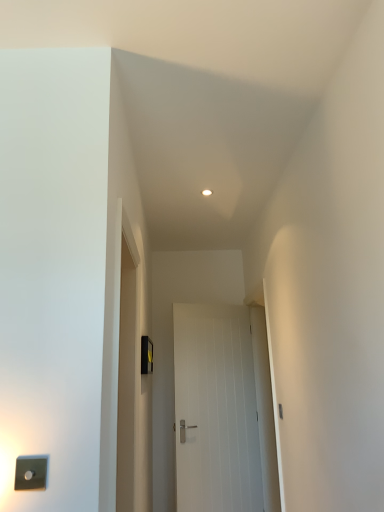
At what (x,y) coordinates should I click in order to perform the action: click on white smooth door at center. Please return your answer as a coordinate pair (x, y). The width and height of the screenshot is (384, 512). Looking at the image, I should click on (216, 410).

This screenshot has height=512, width=384. Describe the element at coordinates (30, 473) in the screenshot. I see `satin silver switch at lower left, arranged as the first light switch when viewed from the front` at that location.

In order to face black plastic light switch at center, the first light switch when ordered from right to left, should I rotate leftwards or rightwards?

Rotate your view left by about 5.717°.

The image size is (384, 512). I want to click on white smooth door at center, so click(216, 410).

Which object is wider, satin silver switch at lower left, which appears as the 1th light switch when viewed from the left, or black plastic light switch at center, the 2th light switch when ordered from front to back?

black plastic light switch at center, the 2th light switch when ordered from front to back.

From the picture: Choose the correct answer: Is satin silver switch at lower left, arranged as the 2th light switch when viewed from the right, inside black plastic light switch at center, the 2th light switch when ordered from front to back, or outside it?

satin silver switch at lower left, arranged as the 2th light switch when viewed from the right, cannot be found inside black plastic light switch at center, the 2th light switch when ordered from front to back.

Based on the photo, does satin silver switch at lower left, arranged as the first light switch when viewed from the front, appear on the left side of black plastic light switch at center, the first light switch when ordered from right to left?

Correct, you'll find satin silver switch at lower left, arranged as the first light switch when viewed from the front, to the left of black plastic light switch at center, the first light switch when ordered from right to left.

How distant is satin silver switch at lower left, arranged as the 2th light switch when viewed from the right, from black plastic light switch at center, which is counted as the 2th light switch, starting from the left?

They are 8.28 feet apart.

Is black plastic light switch at center, the 2th light switch when ordered from front to back, facing away from satin silver switch at lower left, arranged as the first light switch when viewed from the front?

That's not correct — black plastic light switch at center, the 2th light switch when ordered from front to back, is not looking away from satin silver switch at lower left, arranged as the first light switch when viewed from the front.

Which of these two, black plastic light switch at center, the 2th light switch when ordered from front to back, or satin silver switch at lower left, arranged as the 2th light switch when viewed from the right, is smaller?

With smaller size is satin silver switch at lower left, arranged as the 2th light switch when viewed from the right.

From a real-world perspective, who is located lower, black plastic light switch at center, which is counted as the 2th light switch, starting from the left, or satin silver switch at lower left, which appears as the 1th light switch when viewed from the left?

In real-world perspective, satin silver switch at lower left, which appears as the 1th light switch when viewed from the left, is lower.

Is satin silver switch at lower left, arranged as the first light switch when viewed from the front, looking in the opposite direction of white smooth door at center?

Correct, satin silver switch at lower left, arranged as the first light switch when viewed from the front, is looking away from white smooth door at center.

Locate an element on the screen. The image size is (384, 512). door below the satin silver switch at lower left, which appears as the 1th light switch when viewed from the left (from the image's perspective) is located at coordinates (216, 410).

How different are the orientations of satin silver switch at lower left, which appears as the 1th light switch when viewed from the left, and white smooth door at center in degrees?

The angle between the facing direction of satin silver switch at lower left, which appears as the 1th light switch when viewed from the left, and the facing direction of white smooth door at center is 26.5 degrees.

Between satin silver switch at lower left, positioned as the 2th light switch in back-to-front order, and white smooth door at center, which one has more height?

Standing taller between the two is white smooth door at center.

Which is correct: black plastic light switch at center, placed as the 1th light switch when sorted from back to front, is inside white smooth door at center, or outside of it?

The correct answer is: outside.

From the image's perspective, which object appears higher, black plastic light switch at center, the 2th light switch when ordered from front to back, or white smooth door at center?

black plastic light switch at center, the 2th light switch when ordered from front to back, appears higher in the image.

How different are the orientations of black plastic light switch at center, the first light switch when ordered from right to left, and white smooth door at center in degrees?

black plastic light switch at center, the first light switch when ordered from right to left, and white smooth door at center are facing 64.4 degrees away from each other.

Consider the image. From a real-world perspective, is black plastic light switch at center, the 2th light switch when ordered from front to back, on white smooth door at center?

Yes.

From the image's perspective, does white smooth door at center appear higher than satin silver switch at lower left, positioned as the 2th light switch in back-to-front order?

No, from the image's perspective, white smooth door at center is not on top of satin silver switch at lower left, positioned as the 2th light switch in back-to-front order.

Is white smooth door at center in contact with satin silver switch at lower left, positioned as the 2th light switch in back-to-front order?

No, white smooth door at center is not in contact with satin silver switch at lower left, positioned as the 2th light switch in back-to-front order.

Which object is wider, white smooth door at center or satin silver switch at lower left, positioned as the 2th light switch in back-to-front order?

white smooth door at center.

Where is `door behind the black plastic light switch at center, placed as the 1th light switch when sorted from back to front`? The image size is (384, 512). door behind the black plastic light switch at center, placed as the 1th light switch when sorted from back to front is located at coordinates (216, 410).

Between point (184, 341) and point (144, 371), which one is positioned behind?

The point (184, 341) is behind.

From a real-world perspective, which is physically below, white smooth door at center or black plastic light switch at center, the 2th light switch when ordered from front to back?

From a 3D spatial view, white smooth door at center is below.

The width and height of the screenshot is (384, 512). I want to click on light switch above the satin silver switch at lower left, arranged as the first light switch when viewed from the front (from a real-world perspective), so click(146, 355).

You are a GUI agent. You are given a task and a screenshot of the screen. Output one action in this format:
    pyautogui.click(x=<x>, y=<y>)
    Task: Click on the light switch that appears below the black plastic light switch at center, the 2th light switch when ordered from front to back (from a real-world perspective)
    Image resolution: width=384 pixels, height=512 pixels.
    Given the screenshot: What is the action you would take?
    pyautogui.click(x=30, y=473)

When comparing their distances from black plastic light switch at center, the first light switch when ordered from right to left, does satin silver switch at lower left, arranged as the first light switch when viewed from the front, or white smooth door at center seem further?

satin silver switch at lower left, arranged as the first light switch when viewed from the front, lies further to black plastic light switch at center, the first light switch when ordered from right to left, than the other object.

When comparing their distances from satin silver switch at lower left, which appears as the 1th light switch when viewed from the left, does black plastic light switch at center, the 2th light switch when ordered from front to back, or white smooth door at center seem closer?

The object closer to satin silver switch at lower left, which appears as the 1th light switch when viewed from the left, is black plastic light switch at center, the 2th light switch when ordered from front to back.

Looking at the image, which one is located further to satin silver switch at lower left, arranged as the first light switch when viewed from the front, white smooth door at center or black plastic light switch at center, placed as the 1th light switch when sorted from back to front?

white smooth door at center.

Considering their positions, is satin silver switch at lower left, which appears as the 1th light switch when viewed from the left, positioned closer to white smooth door at center than black plastic light switch at center, the first light switch when ordered from right to left?

The object closer to white smooth door at center is black plastic light switch at center, the first light switch when ordered from right to left.

Looking at the image, which one is located closer to black plastic light switch at center, the 2th light switch when ordered from front to back, white smooth door at center or satin silver switch at lower left, arranged as the first light switch when viewed from the front?

Based on the image, white smooth door at center appears to be nearer to black plastic light switch at center, the 2th light switch when ordered from front to back.

Considering their positions, is black plastic light switch at center, the first light switch when ordered from right to left, positioned further to white smooth door at center than satin silver switch at lower left, arranged as the 2th light switch when viewed from the right?

The object further to white smooth door at center is satin silver switch at lower left, arranged as the 2th light switch when viewed from the right.

Locate an element on the screen. This screenshot has height=512, width=384. light switch between satin silver switch at lower left, arranged as the 2th light switch when viewed from the right, and white smooth door at center from front to back is located at coordinates 146,355.